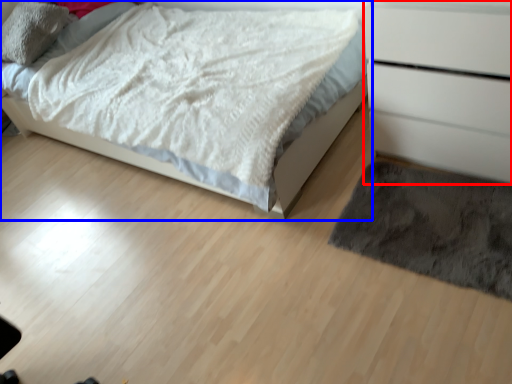
Question: Which object appears closest to the camera in this image, chest of drawers (highlighted by a red box) or bed (highlighted by a blue box)?

Choices:
 (A) chest of drawers
 (B) bed

Answer: (A)